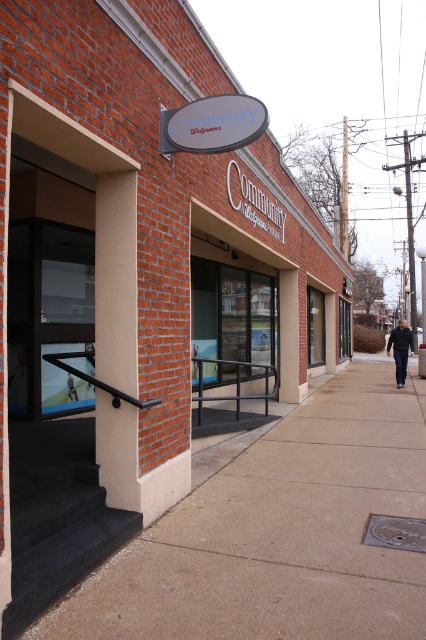
Question: Where is brown concrete sidewalk at lower left located in relation to dark blue jeans at center in the image?

Choices:
 (A) below
 (B) above

Answer: (A)

Question: Is brown concrete sidewalk at lower left in front of dark blue jeans at center?

Choices:
 (A) yes
 (B) no

Answer: (A)

Question: Which point appears farthest from the camera in this image?

Choices:
 (A) (423, 470)
 (B) (411, 333)

Answer: (B)

Question: Does brown concrete sidewalk at lower left lie behind dark blue jeans at center?

Choices:
 (A) no
 (B) yes

Answer: (A)

Question: Among these objects, which one is nearest to the camera?

Choices:
 (A) dark blue jeans at center
 (B) brown concrete sidewalk at lower left

Answer: (B)

Question: Which point is closer to the camera?

Choices:
 (A) brown concrete sidewalk at lower left
 (B) dark blue jeans at center

Answer: (A)